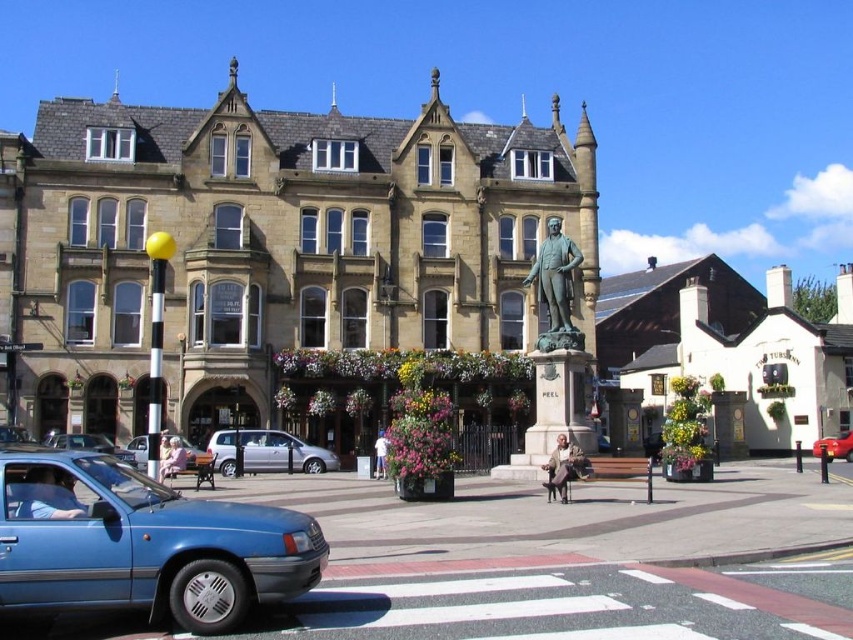
You are a pedestrian standing in front of the historic building and want to cross the street. There is a silver metallic van at center and a metallic red car at center. Which vehicle should you avoid stepping in front of to stay safe?

You should avoid stepping in front of the metallic red car at center because the silver metallic van at center is to the left of it, meaning the metallic red car is closer to the street where you are standing.

You are standing at the entrance of the historic Victorian building and want to park your car. The parking spot you want is at point (282, 452). Which direction should you drive to reach that parking spot?

The silver metallic van at center is located at point (282, 452), so you should drive towards the silver metallic van at center to reach the parking spot.

You are a pedestrian standing on the sidewalk in front of the historic building. You see the silver metallic van at center and the metallic red car at center. Which vehicle is closer to you?

The silver metallic van at center is closer to you because it is in front of the metallic red car at center.